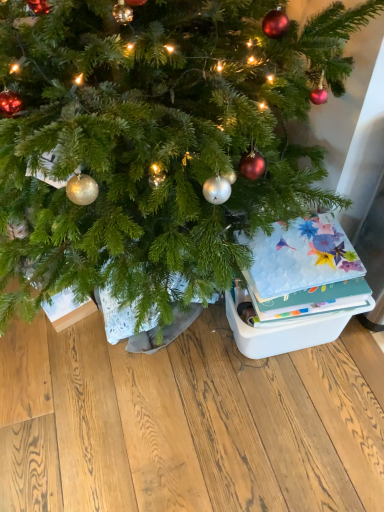
Question: Is floral-patterned paper at right not inside white plastic storage box at lower right?

Choices:
 (A) no
 (B) yes

Answer: (B)

Question: From the image's perspective, is floral-patterned paper at right located beneath white plastic storage box at lower right?

Choices:
 (A) yes
 (B) no

Answer: (B)

Question: Is floral-patterned paper at right next to white plastic storage box at lower right and touching it?

Choices:
 (A) yes
 (B) no

Answer: (B)

Question: Is floral-patterned paper at right to the right of white plastic storage box at lower right from the viewer's perspective?

Choices:
 (A) yes
 (B) no

Answer: (B)

Question: Is floral-patterned paper at right at the left side of white plastic storage box at lower right?

Choices:
 (A) no
 (B) yes

Answer: (B)

Question: From a real-world perspective, relative to green matte christmas tree at center, is floral-patterned paper at right vertically above or below?

Choices:
 (A) below
 (B) above

Answer: (B)

Question: Considering their positions, is floral-patterned paper at right located in front of or behind green matte christmas tree at center?

Choices:
 (A) front
 (B) behind

Answer: (B)

Question: Looking at the image, does floral-patterned paper at right seem bigger or smaller compared to green matte christmas tree at center?

Choices:
 (A) big
 (B) small

Answer: (B)

Question: Is point (334, 302) closer or farther from the camera than point (162, 138)?

Choices:
 (A) closer
 (B) farther

Answer: (B)

Question: Is white plastic storage box at lower right bigger or smaller than floral-patterned paper at right?

Choices:
 (A) big
 (B) small

Answer: (A)

Question: From a real-world perspective, is white plastic storage box at lower right physically located above or below floral-patterned paper at right?

Choices:
 (A) above
 (B) below

Answer: (B)

Question: From the image's perspective, is white plastic storage box at lower right located above or below floral-patterned paper at right?

Choices:
 (A) above
 (B) below

Answer: (B)

Question: In terms of height, does white plastic storage box at lower right look taller or shorter compared to floral-patterned paper at right?

Choices:
 (A) short
 (B) tall

Answer: (B)

Question: From the image's perspective, is green matte christmas tree at center positioned above or below floral-patterned paper at right?

Choices:
 (A) above
 (B) below

Answer: (A)

Question: Visually, is green matte christmas tree at center positioned to the left or to the right of floral-patterned paper at right?

Choices:
 (A) left
 (B) right

Answer: (A)